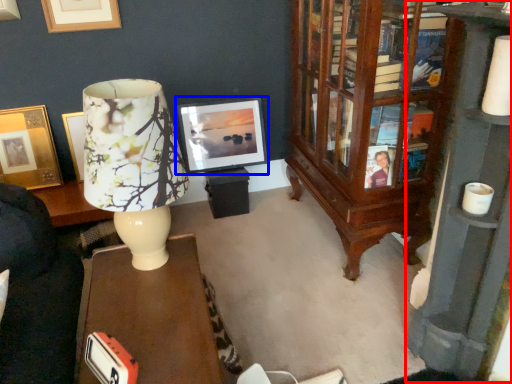
Question: Which point is closer to the camera, bookcase (highlighted by a red box) or picture frame (highlighted by a blue box)?

Choices:
 (A) bookcase
 (B) picture frame

Answer: (A)